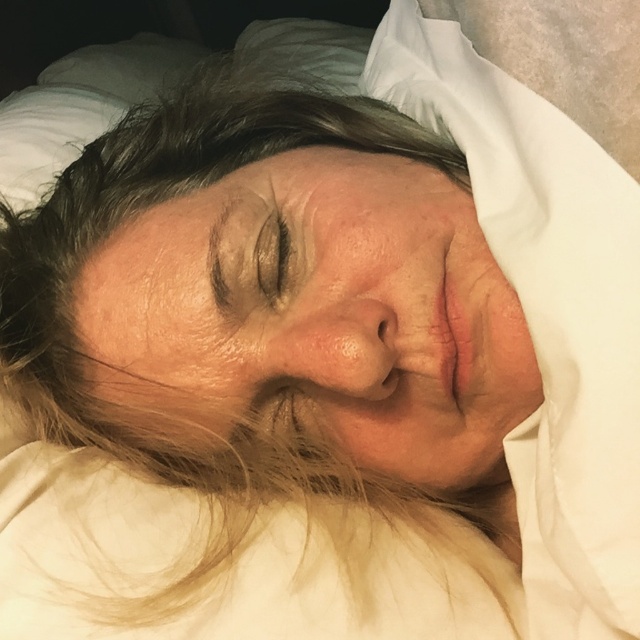
Is point (465, 458) in front of point (256, 284)?

That is False.

Is dry skin at center shorter than brown matte eye at center?

Incorrect, dry skin at center's height does not fall short of brown matte eye at center's.

Is point (410, 388) closer to camera compared to point (282, 300)?

That is True.

I want to click on dry skin at center, so click(x=317, y=317).